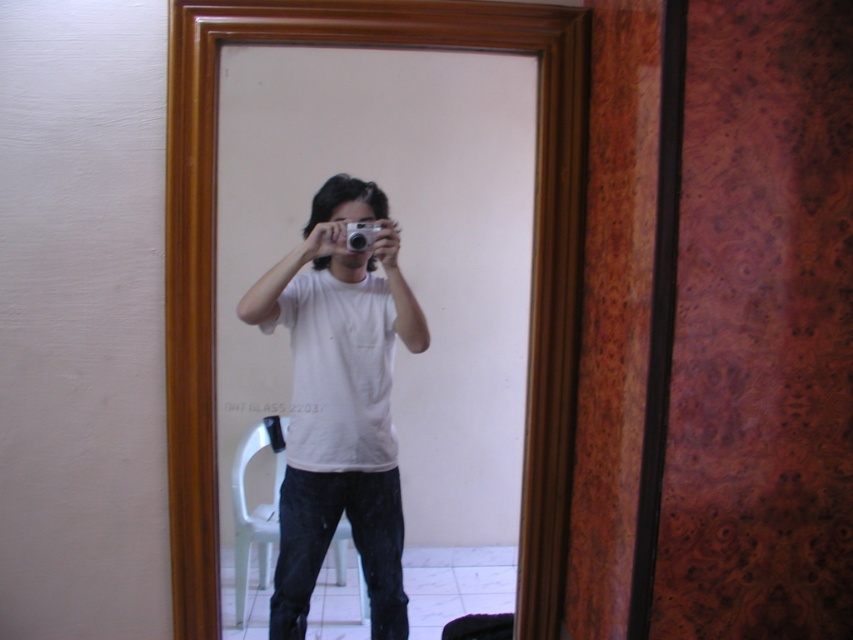
Looking at this image, you are standing in the room and want to take a selfie using the camera. The camera is at point (315, 497). If you need to be at least 1.5 meters away from the camera to take a clear photo, can you position yourself at the point where the camera is located? Explain your reasoning.

The distance between the point (315, 497) and the camera is 1.66 meters. Since 1.66 meters is greater than the required 1.5 meters, you can position yourself at the camera location to take a clear photo as you will be far enough away.

You are trying to take a selfie with a mirror. You have a silver metallic camera at center and a wooden frame at center. Which object is taller?

The wooden frame at center is taller than the silver metallic camera at center.